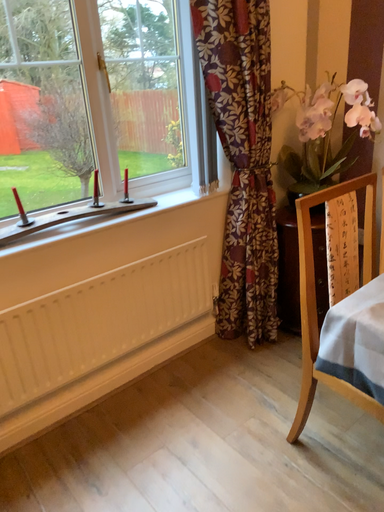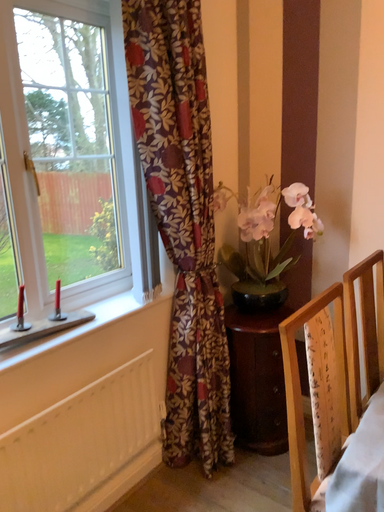
Question: How did the camera likely rotate when shooting the video?

Choices:
 (A) rotated right
 (B) rotated left

Answer: (A)